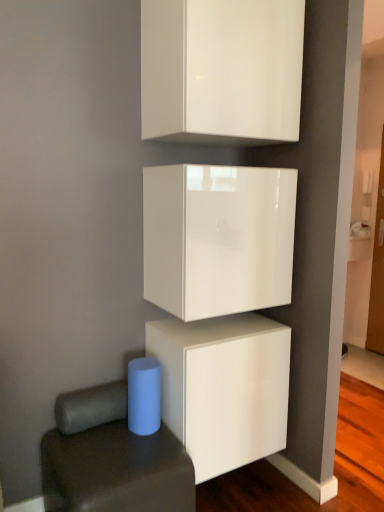
Question: From the image's perspective, is blue matte cylinder at lower left on white glossy cabinet at lower center, the 1th cabinetry positioned from the bottom?

Choices:
 (A) yes
 (B) no

Answer: (B)

Question: Could you tell me if blue matte cylinder at lower left is facing white glossy cabinet at lower center, the third cabinetry in the top-to-bottom sequence?

Choices:
 (A) no
 (B) yes

Answer: (A)

Question: Can you confirm if blue matte cylinder at lower left is bigger than white glossy cabinet at lower center, the third cabinetry in the top-to-bottom sequence?

Choices:
 (A) yes
 (B) no

Answer: (B)

Question: Can you confirm if blue matte cylinder at lower left is positioned to the left of white glossy cabinet at lower center, the 1th cabinetry positioned from the bottom?

Choices:
 (A) no
 (B) yes

Answer: (B)

Question: From the image's perspective, is blue matte cylinder at lower left below white glossy cabinet at lower center, the third cabinetry in the top-to-bottom sequence?

Choices:
 (A) no
 (B) yes

Answer: (B)

Question: Looking at the image, does white glossy cabinet at lower center, the third cabinetry in the top-to-bottom sequence, seem bigger or smaller compared to blue matte cylinder at lower left?

Choices:
 (A) big
 (B) small

Answer: (A)

Question: From the image's perspective, is white glossy cabinet at lower center, the third cabinetry in the top-to-bottom sequence, located above or below blue matte cylinder at lower left?

Choices:
 (A) above
 (B) below

Answer: (A)

Question: Considering the positions of point (254, 454) and point (105, 432), is point (254, 454) closer or farther from the camera than point (105, 432)?

Choices:
 (A) closer
 (B) farther

Answer: (B)

Question: In terms of width, does white glossy cabinet at lower center, the 1th cabinetry positioned from the bottom, look wider or thinner when compared to blue matte cylinder at lower left?

Choices:
 (A) thin
 (B) wide

Answer: (A)

Question: From their relative heights in the image, would you say glossy white cube at center, the second cabinetry when ordered from bottom to top, is taller or shorter than blue matte cylinder at lower left?

Choices:
 (A) tall
 (B) short

Answer: (A)

Question: Is glossy white cube at center, the second cabinetry from the top, inside or outside of blue matte cylinder at lower left?

Choices:
 (A) inside
 (B) outside

Answer: (B)

Question: From a real-world perspective, relative to blue matte cylinder at lower left, is glossy white cube at center, the second cabinetry when ordered from bottom to top, vertically above or below?

Choices:
 (A) below
 (B) above

Answer: (B)

Question: From the image's perspective, is glossy white cube at center, the second cabinetry from the top, located above or below blue matte cylinder at lower left?

Choices:
 (A) above
 (B) below

Answer: (A)

Question: Is blue matte cylinder at lower left bigger or smaller than white glossy cabinet at lower center, the third cabinetry in the top-to-bottom sequence?

Choices:
 (A) small
 (B) big

Answer: (A)

Question: In terms of height, does blue matte cylinder at lower left look taller or shorter compared to white glossy cabinet at lower center, the third cabinetry in the top-to-bottom sequence?

Choices:
 (A) tall
 (B) short

Answer: (B)